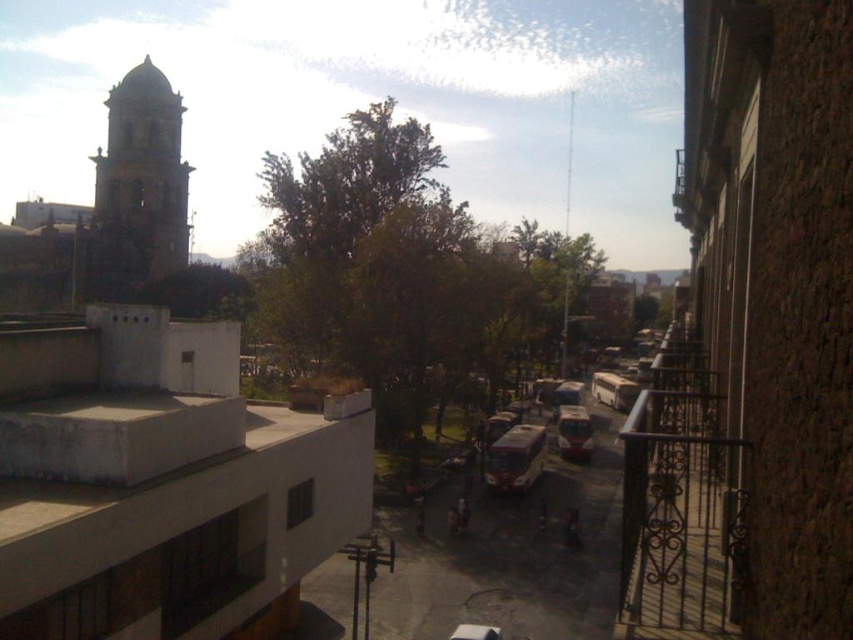
Which is above, dark gray stone bell tower at upper left or metallic silver bus at center?

dark gray stone bell tower at upper left is above.

From the picture: Is dark gray stone bell tower at upper left positioned in front of metallic silver bus at center?

No, dark gray stone bell tower at upper left is behind metallic silver bus at center.

Locate an element on the screen. dark gray stone bell tower at upper left is located at coordinates (138, 182).